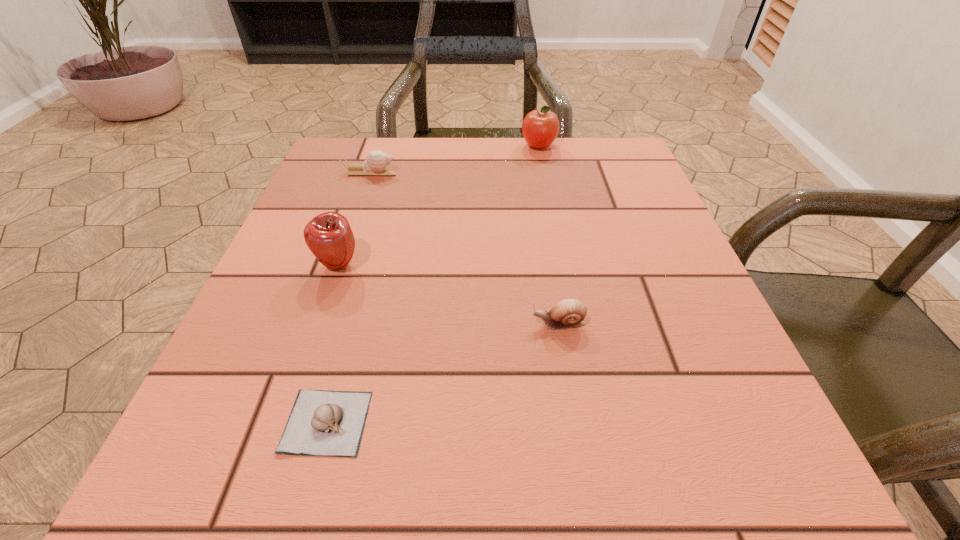
Find the location of a particular element. Image resolution: width=960 pixels, height=540 pixels. free region that satisfies the following two spatial constraints: 1. on the shell of the left escargot; 2. on the back side of the garlic is located at coordinates (285, 422).

Image resolution: width=960 pixels, height=540 pixels. Find the location of `vacant space that satisfies the following two spatial constraints: 1. on the front side of the left apple; 2. on the left side of the nearest object`. vacant space that satisfies the following two spatial constraints: 1. on the front side of the left apple; 2. on the left side of the nearest object is located at coordinates (284, 422).